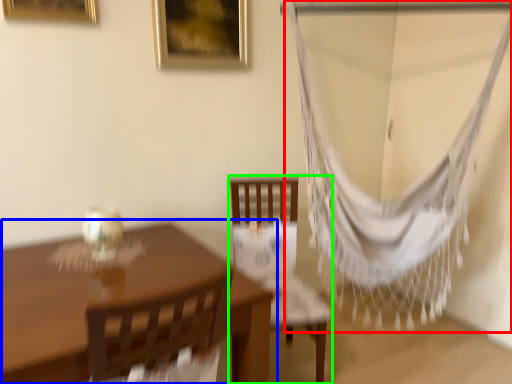
Question: Considering the real-world distances, which object is closest to curtain (highlighted by a red box)? table (highlighted by a blue box) or chair (highlighted by a green box).

Choices:
 (A) table
 (B) chair

Answer: (B)